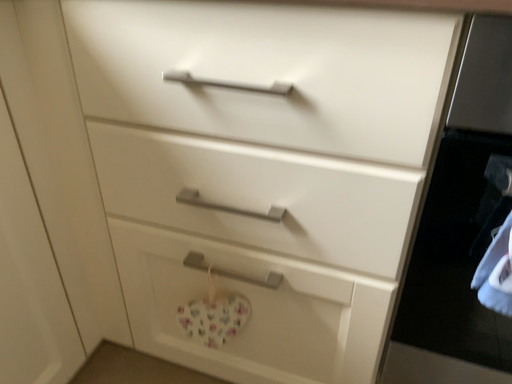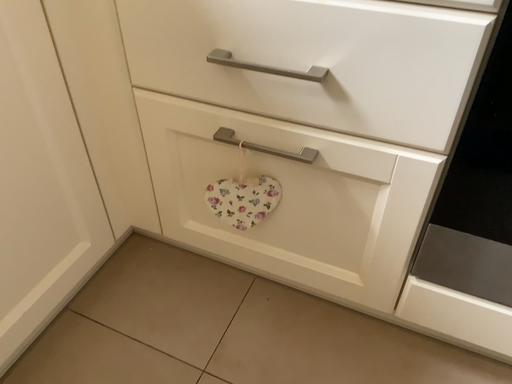
Question: Which way did the camera rotate in the video?

Choices:
 (A) rotated upward
 (B) rotated downward

Answer: (B)